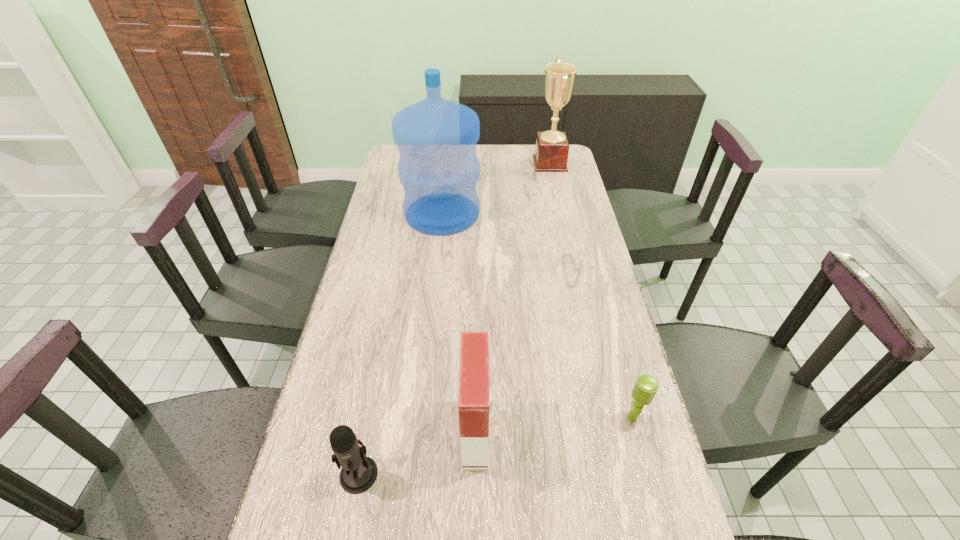
The width and height of the screenshot is (960, 540). I want to click on free space located on the plaque of the second tallest object, so click(x=490, y=164).

Where is `vacant space situated on the plaque of the second tallest object`? vacant space situated on the plaque of the second tallest object is located at coordinates (496, 164).

You are a GUI agent. You are given a task and a screenshot of the screen. Output one action in this format:
    pyautogui.click(x=<x>, y=<y>)
    Task: Click on the vacant space located on the plaque of the second tallest object
    
    Given the screenshot: What is the action you would take?
    pyautogui.click(x=496, y=164)

This screenshot has height=540, width=960. Find the location of `blank area located on the front-facing side of the cigarette_case`. blank area located on the front-facing side of the cigarette_case is located at coordinates (513, 433).

This screenshot has width=960, height=540. I want to click on vacant region located on the right of the nearer microphone, so pyautogui.click(x=538, y=474).

Image resolution: width=960 pixels, height=540 pixels. I want to click on free space located 0.350m on the left of the shorter microphone, so tap(480, 418).

In order to click on object located in the far edge section of the desktop in this screenshot , I will do tap(552, 148).

In order to click on water jug that is at the left edge in this screenshot , I will do `click(436, 138)`.

Locate an element on the screen. microphone situated at the left edge is located at coordinates (359, 472).

This screenshot has height=540, width=960. What are the coordinates of `trophy cup present at the right edge` in the screenshot? It's located at (552, 148).